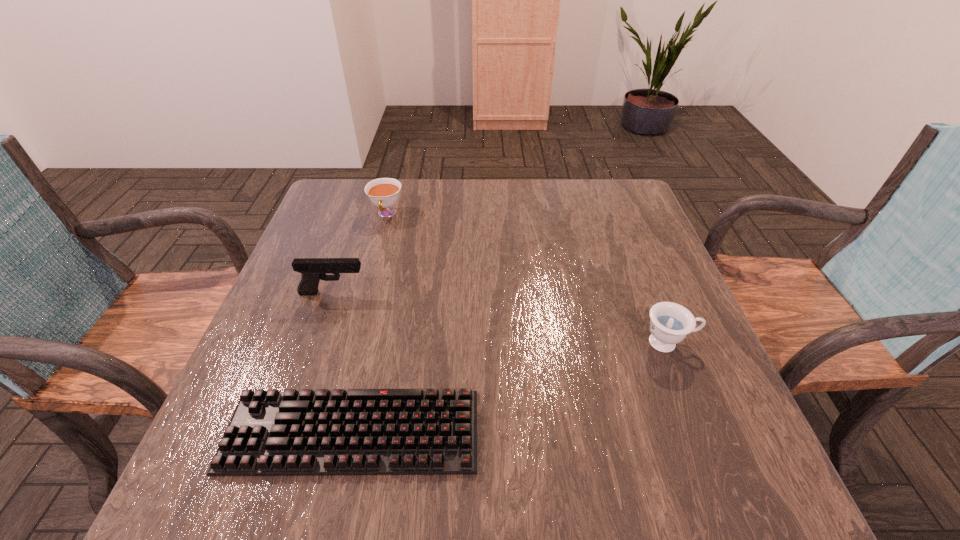
You are a GUI agent. You are given a task and a screenshot of the screen. Output one action in this format:
    pyautogui.click(x=<x>, y=<y>)
    Task: Click on the vacant region at the left edge of the desktop
    
    Given the screenshot: What is the action you would take?
    pyautogui.click(x=338, y=323)

In the image, there is a desktop. Where is `blank space at the right edge`? blank space at the right edge is located at coordinates (627, 310).

The image size is (960, 540). Find the location of `free space at the far left corner of the desktop`. free space at the far left corner of the desktop is located at coordinates (356, 187).

In the image, there is a desktop. What are the coordinates of `vacant space at the far right corner` in the screenshot? It's located at click(x=619, y=217).

In the image, there is a desktop. Identify the location of vacant area at the near right corner. (763, 502).

The height and width of the screenshot is (540, 960). Identify the location of vacant space in between the computer keyboard and the third farthest object. coord(511,387).

At what (x,y) coordinates should I click in order to perform the action: click on empty space that is in between the nearer teacup and the farthest object. Please return your answer as a coordinate pair (x, y). Looking at the image, I should click on (528, 278).

Where is `free point between the computer keyboard and the tallest object`? The width and height of the screenshot is (960, 540). free point between the computer keyboard and the tallest object is located at coordinates (343, 362).

The height and width of the screenshot is (540, 960). In order to click on vacant point located between the nearest object and the second farthest object in this screenshot , I will do tap(343, 362).

Locate an element on the screen. The height and width of the screenshot is (540, 960). vacant space that's between the pistol and the computer keyboard is located at coordinates (343, 362).